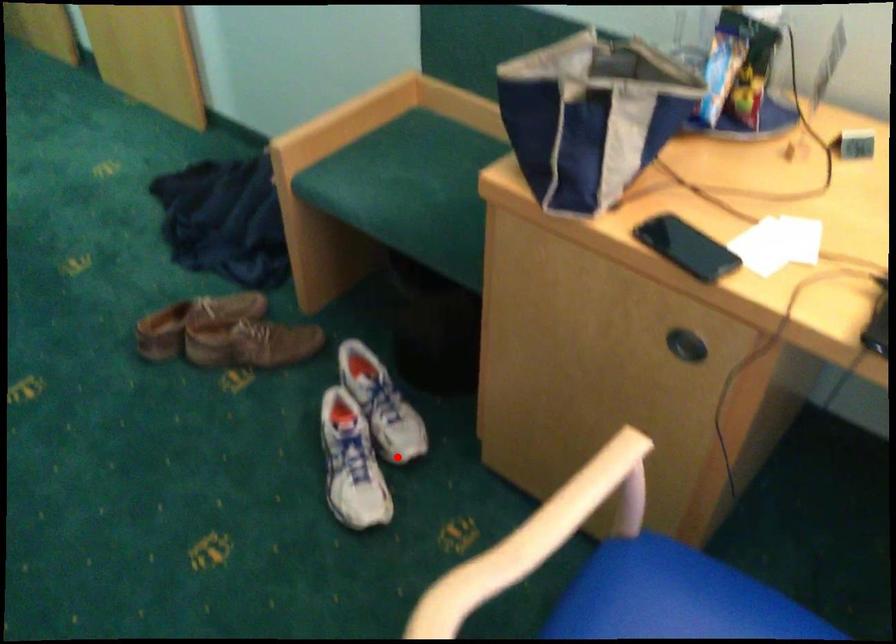
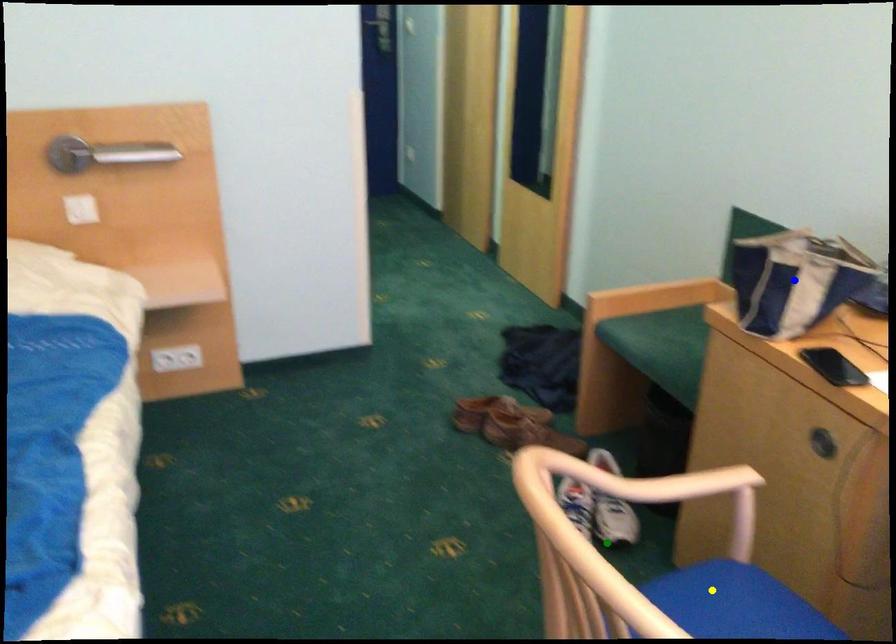
Question: I am providing you with two images of the same scene from different viewpoints. A red point is marked on the first image. You are given multiple points on the second image. Can you choose the point in image 2 that corresponds to the point in image 1?

Choices:
 (A) blue point
 (B) green point
 (C) yellow point

Answer: (B)